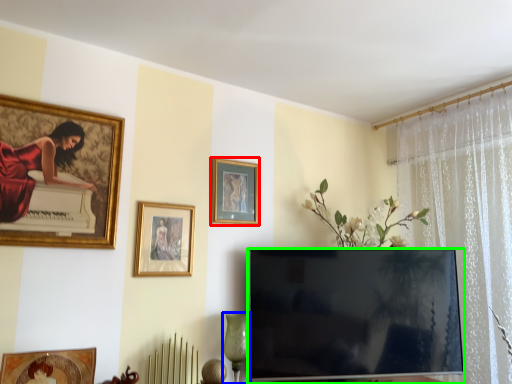
Question: Which is nearer to the picture frame (highlighted by a red box)? glass vase (highlighted by a blue box) or television (highlighted by a green box).

Choices:
 (A) glass vase
 (B) television

Answer: (B)